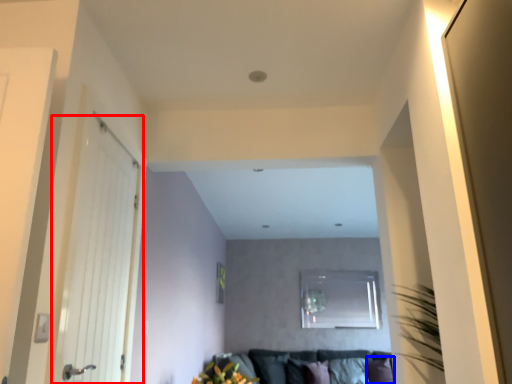
Question: Which point is closer to the camera, door (highlighted by a red box) or pillow (highlighted by a blue box)?

Choices:
 (A) door
 (B) pillow

Answer: (A)